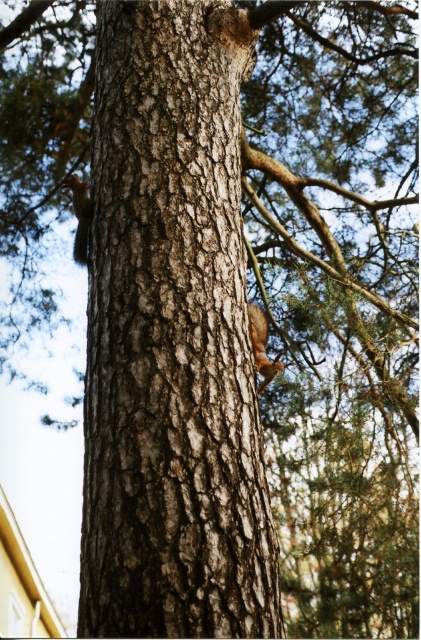
You are a bird flying towards the tree trunk. You see the brown rough bark at center and the brown furry squirrel at center. Which object is closer to you as you approach the tree?

The brown rough bark at center is closer to you because it is positioned over the brown furry squirrel at center, meaning the squirrel is behind the bark from your perspective.

You are a photographer trying to capture both the brown rough bark at center and the brown furry squirrel at left in the same frame. Based on their sizes, which one should you focus on to ensure both are visible without needing to zoom in or out?

The brown rough bark at center is taller than the brown furry squirrel at left, so you should focus on the brown rough bark at center to ensure both fit in the frame without needing to adjust the zoom.

You are standing in front of the tree trunk and want to touch the brown furry squirrel at left. Is the brown rough bark at center blocking your view to the squirrel?

The brown rough bark at center is closer to the viewer than the brown furry squirrel at left, so it is blocking your view to the squirrel.